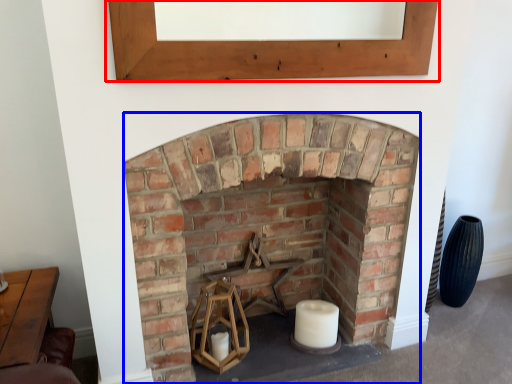
Question: Which of the following is the closest to the observer, window frame (highlighted by a red box) or fireplace (highlighted by a blue box)?

Choices:
 (A) window frame
 (B) fireplace

Answer: (A)